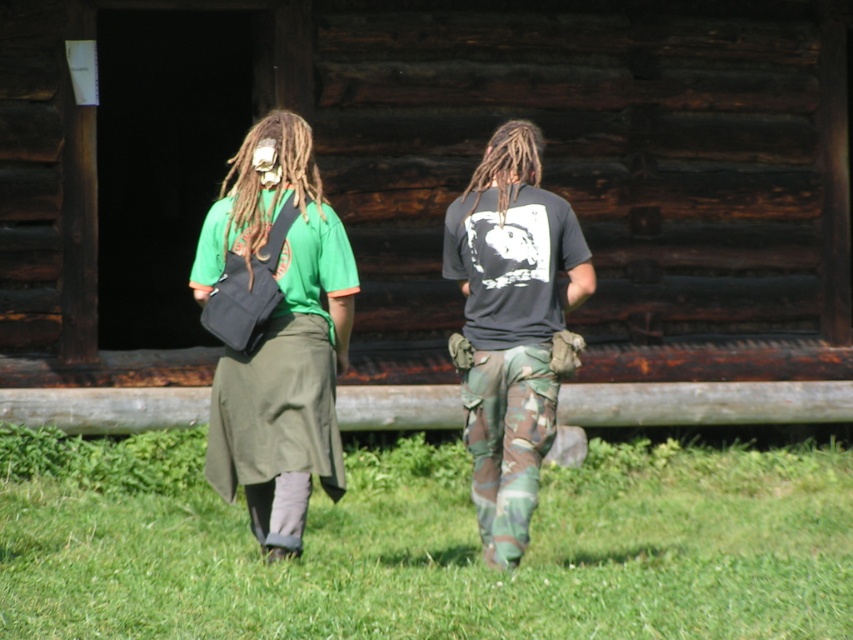
You are standing at the point marked by the coordinates (425, 545) in the image. Looking towards the rustic wooden building, which direction should you walk to reach it?

The point marked by the coordinates (425, 545) is located at the green grass at lower center. Since the individuals are walking away from the camera towards the rustic wooden building, you should walk forward from the green grass at lower center to reach the building.

You are a photographer trying to capture a candid shot of the two people walking towards the rustic wooden building. You need to ensure that both the green fabric skirt at center and the dreadlocks at center are in focus. Based on the scene, what is the minimum distance you should set your camera lens to focus on to ensure both are sharp?

The minimum focusing distance should be set to at least 1.00 meters to ensure both the green fabric skirt at center and the dreadlocks at center are in focus.